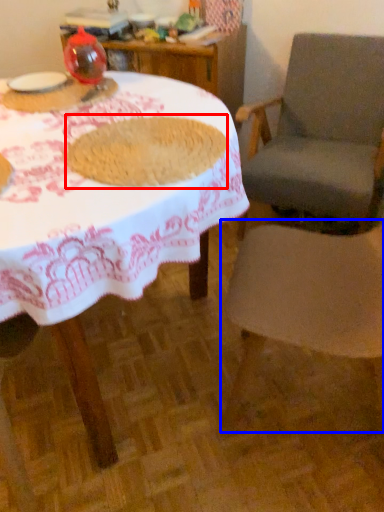
Question: Among these objects, which one is farthest to the camera, food (highlighted by a red box) or chair (highlighted by a blue box)?

Choices:
 (A) food
 (B) chair

Answer: (A)